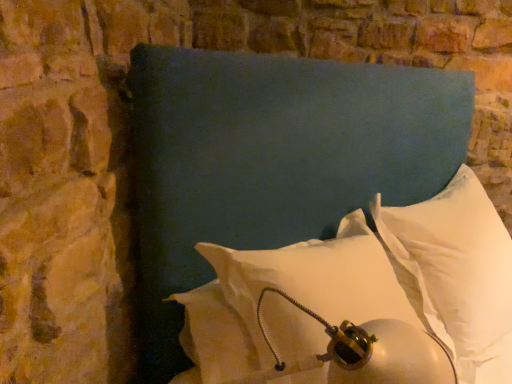
This screenshot has width=512, height=384. Describe the element at coordinates (456, 273) in the screenshot. I see `white soft pillow at center, arranged as the 3th pillow when viewed from the left` at that location.

This screenshot has width=512, height=384. I want to click on white soft pillow at center, arranged as the 2th pillow when viewed from the left, so click(271, 161).

Considering the points (202, 247) and (470, 317), which point is in front, point (202, 247) or point (470, 317)?

The point (202, 247) is closer.

From the image's perspective, is white soft pillow at lower right, the 3th pillow from the right, above white soft pillow at center, arranged as the 3th pillow when viewed from the left?

Incorrect, from the image's perspective, white soft pillow at lower right, the 3th pillow from the right, is lower than white soft pillow at center, arranged as the 3th pillow when viewed from the left.

Are white soft pillow at lower right, placed as the first pillow when sorted from left to right, and white soft pillow at center, which is the 1th pillow in right-to-left order, beside each other?

white soft pillow at lower right, placed as the first pillow when sorted from left to right, and white soft pillow at center, which is the 1th pillow in right-to-left order, are not in contact.

Which is less distant, (414, 262) or (323, 334)?

Point (414, 262) is positioned farther from the camera compared to point (323, 334).

From the image's perspective, relative to white soft pillow at lower right, the 3th pillow from the right, is white soft pillow at center, which is the 1th pillow in right-to-left order, above or below?

white soft pillow at center, which is the 1th pillow in right-to-left order, is above white soft pillow at lower right, the 3th pillow from the right.

Are white soft pillow at center, arranged as the 3th pillow when viewed from the left, and white soft pillow at lower right, the 3th pillow from the right, far apart?

No, there isn't a large distance between white soft pillow at center, arranged as the 3th pillow when viewed from the left, and white soft pillow at lower right, the 3th pillow from the right.

Considering the sizes of objects white soft pillow at center, arranged as the 3th pillow when viewed from the left, and white soft pillow at lower right, placed as the first pillow when sorted from left to right, in the image provided, who is smaller, white soft pillow at center, arranged as the 3th pillow when viewed from the left, or white soft pillow at lower right, placed as the first pillow when sorted from left to right,?

With smaller size is white soft pillow at center, arranged as the 3th pillow when viewed from the left.

In the scene shown: Is white soft pillow at lower right, placed as the first pillow when sorted from left to right, not near white soft pillow at center, arranged as the 2th pillow when viewed from the left?

white soft pillow at lower right, placed as the first pillow when sorted from left to right, is actually quite close to white soft pillow at center, arranged as the 2th pillow when viewed from the left.

Is white soft pillow at lower right, placed as the first pillow when sorted from left to right, facing away from white soft pillow at center, the second pillow from the right?

Yes.

Considering the relative sizes of white soft pillow at lower right, the 3th pillow from the right, and white soft pillow at center, the second pillow from the right, in the image provided, is white soft pillow at lower right, the 3th pillow from the right, wider than white soft pillow at center, the second pillow from the right,?

Incorrect, the width of white soft pillow at lower right, the 3th pillow from the right, does not surpass that of white soft pillow at center, the second pillow from the right.

Looking at this image, looking at their sizes, would you say white soft pillow at center, the second pillow from the right, is wider or thinner than white soft pillow at lower right, placed as the first pillow when sorted from left to right?

Clearly, white soft pillow at center, the second pillow from the right, has more width compared to white soft pillow at lower right, placed as the first pillow when sorted from left to right.

Consider the image. Could you measure the distance between white soft pillow at center, the second pillow from the right, and white soft pillow at lower right, placed as the first pillow when sorted from left to right?

white soft pillow at center, the second pillow from the right, and white soft pillow at lower right, placed as the first pillow when sorted from left to right, are 13.48 inches apart from each other.

Does white soft pillow at center, arranged as the 2th pillow when viewed from the left, appear on the right side of white soft pillow at lower right, the 3th pillow from the right?

Yes.

Is white soft pillow at center, the second pillow from the right, aimed at white soft pillow at lower right, the 3th pillow from the right?

Yes, white soft pillow at center, the second pillow from the right, faces towards white soft pillow at lower right, the 3th pillow from the right.

From the image's perspective, which is below, white soft pillow at center, which is the 1th pillow in right-to-left order, or white soft pillow at center, arranged as the 2th pillow when viewed from the left?

white soft pillow at center, arranged as the 2th pillow when viewed from the left, from the image's perspective.

From a real-world perspective, who is located higher, white soft pillow at center, arranged as the 3th pillow when viewed from the left, or white soft pillow at center, the second pillow from the right?

white soft pillow at center, the second pillow from the right, from a real-world perspective.

Is white soft pillow at center, which is the 1th pillow in right-to-left order, spatially inside white soft pillow at center, the second pillow from the right, or outside of it?

white soft pillow at center, which is the 1th pillow in right-to-left order, is not enclosed by white soft pillow at center, the second pillow from the right.

Which object is thinner, white soft pillow at center, the second pillow from the right, or white soft pillow at center, which is the 1th pillow in right-to-left order?

With smaller width is white soft pillow at center, which is the 1th pillow in right-to-left order.

From the image's perspective, is white soft pillow at center, the second pillow from the right, located above or below white soft pillow at center, arranged as the 3th pillow when viewed from the left?

Clearly, from the image's perspective, white soft pillow at center, the second pillow from the right, is below white soft pillow at center, arranged as the 3th pillow when viewed from the left.

Where is `the 1st pillow below the white soft pillow at center, which is the 1th pillow in right-to-left order (from the image's perspective)`? This screenshot has width=512, height=384. the 1st pillow below the white soft pillow at center, which is the 1th pillow in right-to-left order (from the image's perspective) is located at coordinates (271, 161).

Could you measure the distance between white soft pillow at center, arranged as the 2th pillow when viewed from the left, and white soft pillow at center, arranged as the 3th pillow when viewed from the left?

white soft pillow at center, arranged as the 2th pillow when viewed from the left, and white soft pillow at center, arranged as the 3th pillow when viewed from the left, are 15.21 inches apart.

The height and width of the screenshot is (384, 512). In order to click on pillow lying behind the white soft pillow at lower right, the 3th pillow from the right in this screenshot , I will do `click(456, 273)`.

The height and width of the screenshot is (384, 512). I want to click on pillow that is the 2nd object to the right of the white soft pillow at lower right, the 3th pillow from the right, starting at the anchor, so click(x=456, y=273).

Which object lies nearer to the anchor point white soft pillow at center, which is the 1th pillow in right-to-left order, white soft pillow at center, arranged as the 2th pillow when viewed from the left, or white soft pillow at lower right, placed as the first pillow when sorted from left to right?

white soft pillow at center, arranged as the 2th pillow when viewed from the left, is positioned closer to the anchor white soft pillow at center, which is the 1th pillow in right-to-left order.

From the image, which object appears to be nearer to white soft pillow at center, the second pillow from the right, white soft pillow at center, which is the 1th pillow in right-to-left order, or white soft pillow at lower right, the 3th pillow from the right?

white soft pillow at lower right, the 3th pillow from the right.

When comparing their distances from white soft pillow at lower right, placed as the first pillow when sorted from left to right, does white soft pillow at center, arranged as the 2th pillow when viewed from the left, or white soft pillow at center, which is the 1th pillow in right-to-left order, seem further?

white soft pillow at center, which is the 1th pillow in right-to-left order, is positioned further to the anchor white soft pillow at lower right, placed as the first pillow when sorted from left to right.

Looking at the image, which one is located closer to white soft pillow at center, which is the 1th pillow in right-to-left order, white soft pillow at lower right, the 3th pillow from the right, or white soft pillow at center, arranged as the 2th pillow when viewed from the left?

Based on the image, white soft pillow at center, arranged as the 2th pillow when viewed from the left, appears to be nearer to white soft pillow at center, which is the 1th pillow in right-to-left order.

Estimate the real-world distances between objects in this image. Which object is closer to white soft pillow at center, arranged as the 2th pillow when viewed from the left, white soft pillow at lower right, placed as the first pillow when sorted from left to right, or white soft pillow at center, arranged as the 3th pillow when viewed from the left?

white soft pillow at lower right, placed as the first pillow when sorted from left to right, is closer to white soft pillow at center, arranged as the 2th pillow when viewed from the left.

Estimate the real-world distances between objects in this image. Which object is further from white soft pillow at lower right, the 3th pillow from the right, white soft pillow at center, which is the 1th pillow in right-to-left order, or white soft pillow at center, arranged as the 2th pillow when viewed from the left?

The object further to white soft pillow at lower right, the 3th pillow from the right, is white soft pillow at center, which is the 1th pillow in right-to-left order.

At what (x,y) coordinates should I click in order to perform the action: click on pillow between white soft pillow at lower right, the 3th pillow from the right, and white soft pillow at center, which is the 1th pillow in right-to-left order, from left to right. Please return your answer as a coordinate pair (x, y). Looking at the image, I should click on (271, 161).